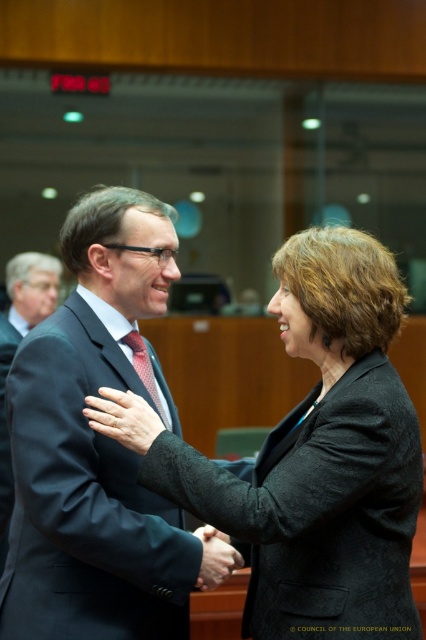
Question: Which point is farther to the camera?

Choices:
 (A) matte black suit at center
 (B) matte red tie at center
 (C) black suit at center

Answer: (C)

Question: Is black suit at center thinner than smooth leather hand at center?

Choices:
 (A) no
 (B) yes

Answer: (A)

Question: Is dark gray textured blazer at center to the left of matte red tie at center from the viewer's perspective?

Choices:
 (A) no
 (B) yes

Answer: (A)

Question: Which point is closer to the camera?

Choices:
 (A) (212, 545)
 (B) (164, 419)
 (C) (112, 349)

Answer: (A)

Question: Among these objects, which one is farthest from the camera?

Choices:
 (A) black suit at center
 (B) dark gray wool suit at left
 (C) dark gray textured blazer at center

Answer: (A)

Question: Does dark gray textured blazer at center appear under matte red tie at center?

Choices:
 (A) no
 (B) yes

Answer: (B)